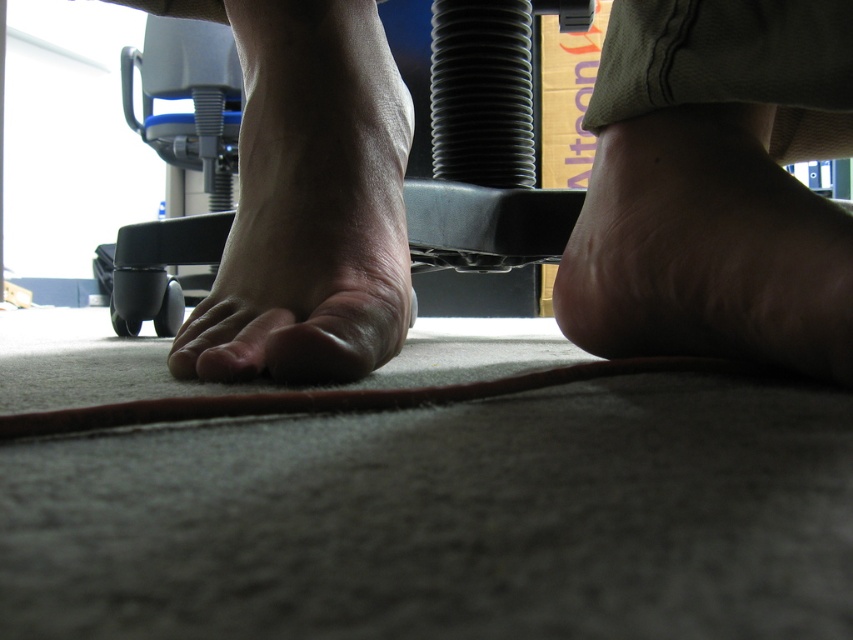
Which is above, black plastic chair at center or pink flesh at center?

black plastic chair at center

What do you see at coordinates (486, 141) in the screenshot?
I see `black plastic chair at center` at bounding box center [486, 141].

Find the location of a particular element. The height and width of the screenshot is (640, 853). black plastic chair at center is located at coordinates (486, 141).

Does matte skin toe at center appear on the right side of pink flesh at center?

Correct, you'll find matte skin toe at center to the right of pink flesh at center.

Does matte skin toe at center have a greater height compared to pink flesh at center?

Correct, matte skin toe at center is much taller as pink flesh at center.

Where is `matte skin toe at center`? matte skin toe at center is located at coordinates (231, 358).

Between skinny barefoot at lower left and black plastic chair at center, which one appears on the right side from the viewer's perspective?

Positioned to the right is skinny barefoot at lower left.

Who is shorter, skinny barefoot at lower left or black plastic chair at center?

skinny barefoot at lower left is shorter.

Who is more forward, (390,156) or (193,61)?

Positioned in front is point (390,156).

At what (x,y) coordinates should I click in order to perform the action: click on skinny barefoot at lower left. Please return your answer as a coordinate pair (x, y). The height and width of the screenshot is (640, 853). Looking at the image, I should click on (315, 195).